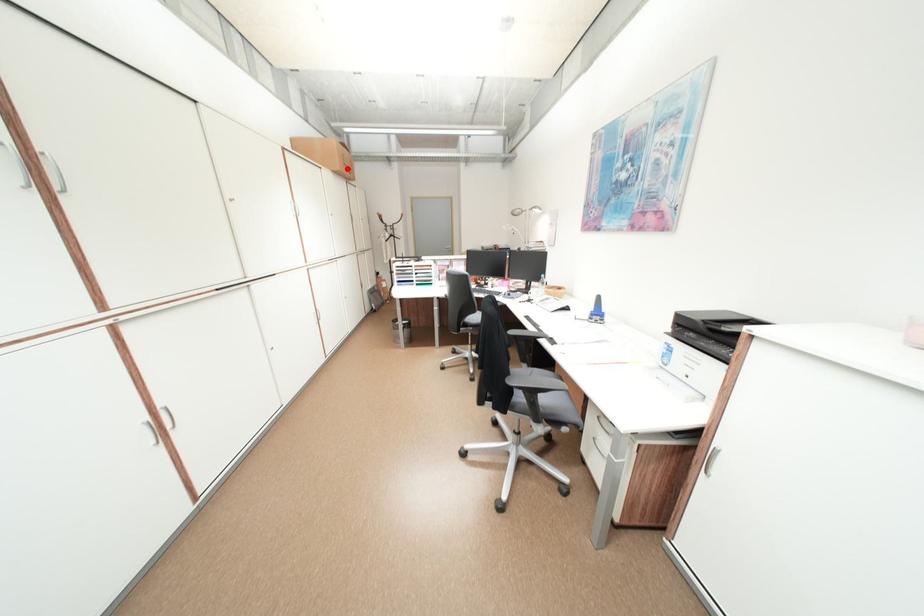
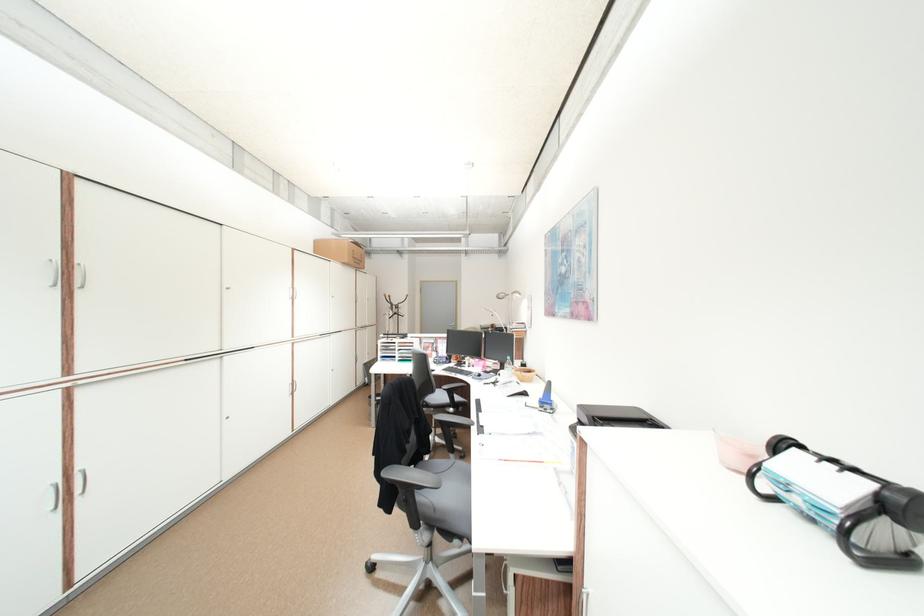
The point at the highlighted location is marked in the first image. Where is the corresponding point in the second image?

(356, 262)